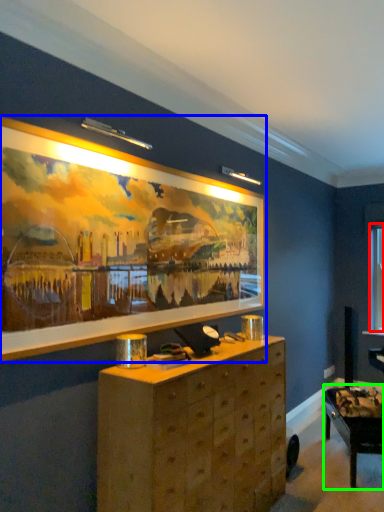
Question: Which object is the farthest from window (highlighted by a red box)? Choose among these: picture frame (highlighted by a blue box) or table (highlighted by a green box).

Choices:
 (A) picture frame
 (B) table

Answer: (A)